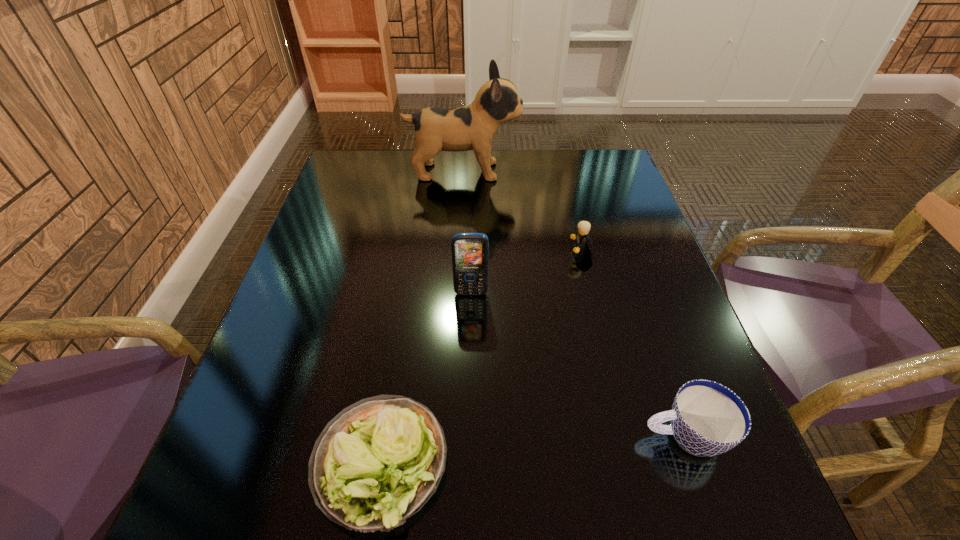
The image size is (960, 540). I want to click on cup at the right edge, so click(707, 419).

Where is `object that is at the near left corner`? object that is at the near left corner is located at coordinates (376, 463).

Where is `vacant space at the far edge of the desktop`? vacant space at the far edge of the desktop is located at coordinates (435, 161).

This screenshot has width=960, height=540. In the image, there is a desktop. What are the coordinates of `vacant space at the left edge` in the screenshot? It's located at (303, 274).

Find the location of a particular element. vacant space at the right edge is located at coordinates (649, 266).

The image size is (960, 540). In order to click on vacant space at the near right corner of the desktop in this screenshot , I will do 733,502.

Locate an element on the screen. vacant region between the fourth nearest object and the lettuce is located at coordinates (481, 356).

Locate an element on the screen. The image size is (960, 540). empty location between the fourth shortest object and the Lego is located at coordinates (526, 272).

Where is `free space between the farthest object and the Lego`? The width and height of the screenshot is (960, 540). free space between the farthest object and the Lego is located at coordinates (522, 211).

Image resolution: width=960 pixels, height=540 pixels. What are the coordinates of `free point between the cellular telephone and the Lego` in the screenshot? It's located at (526, 272).